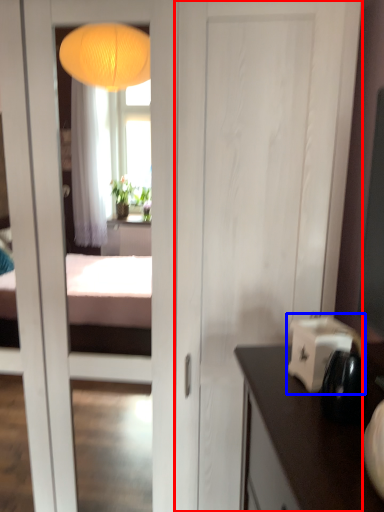
Question: Among these objects, which one is nearest to the camera, door (highlighted by a red box) or appliance (highlighted by a blue box)?

Choices:
 (A) door
 (B) appliance

Answer: (B)